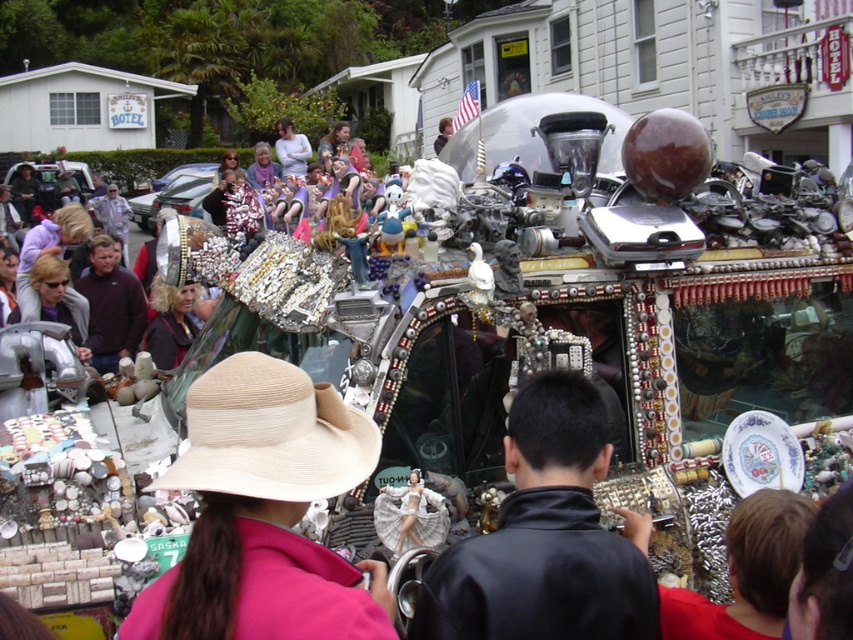
Question: Is black leather jacket at center to the left of beige straw hat at center from the viewer's perspective?

Choices:
 (A) yes
 (B) no

Answer: (B)

Question: Is black leather jacket at center behind beige straw hat at center?

Choices:
 (A) yes
 (B) no

Answer: (A)

Question: From the image, what is the correct spatial relationship of black leather jacket at center in relation to beige straw hat at center?

Choices:
 (A) right
 (B) left

Answer: (A)

Question: Which point is farther to the camera?

Choices:
 (A) black leather jacket at center
 (B) pink fabric hat at center
 (C) beige straw hat at center

Answer: (A)

Question: Among these points, which one is farthest from the camera?

Choices:
 (A) (300, 484)
 (B) (350, 432)
 (C) (637, 572)

Answer: (B)

Question: Which object appears closest to the camera in this image?

Choices:
 (A) beige straw hat at center
 (B) pink fabric hat at center
 (C) black leather jacket at center

Answer: (B)